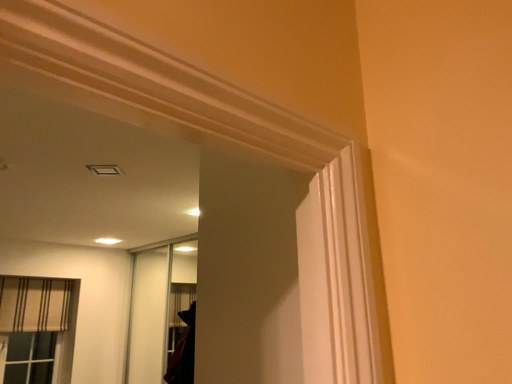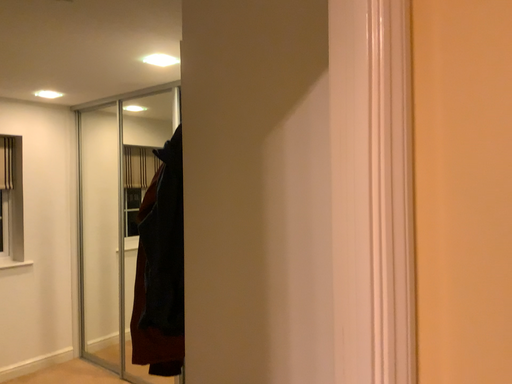
Question: Which way did the camera rotate in the video?

Choices:
 (A) rotated right
 (B) rotated left

Answer: (A)